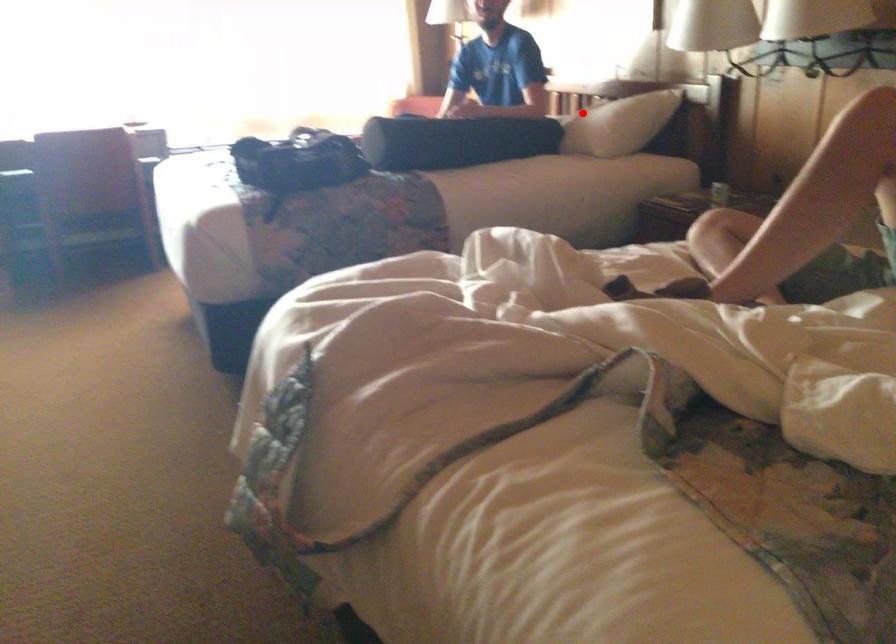
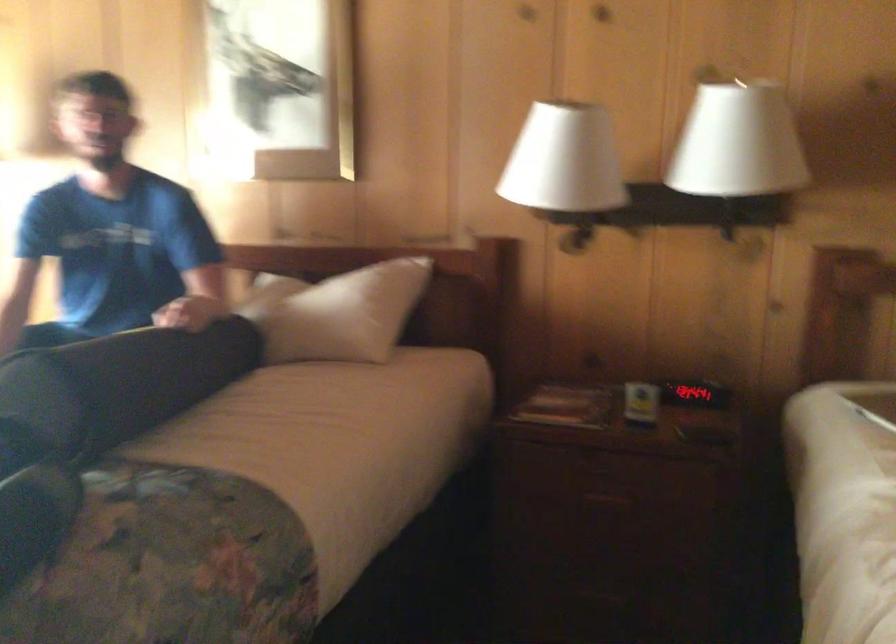
Question: A red point is marked in image1. In image2, is the corresponding 3D point closer to the camera or farther? Reply with the corresponding letter.

Choices:
 (A) The corresponding 3D point is closer.
 (B) The corresponding 3D point is farther.

Answer: (A)